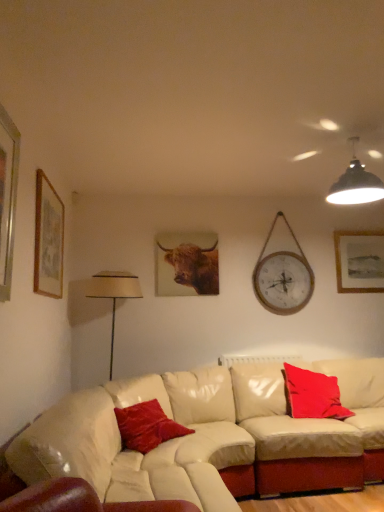
Measure the distance between point [320,386] and camera.

The distance of point [320,386] from camera is 11.64 feet.

The height and width of the screenshot is (512, 384). Describe the element at coordinates (356, 183) in the screenshot. I see `black matte pendant light at upper right` at that location.

What is the approximate height of brown furry cow at center?

It is 24.70 inches.

This screenshot has width=384, height=512. What do you see at coordinates (194, 266) in the screenshot? I see `brown furry cow at center` at bounding box center [194, 266].

I want to click on silver metallic picture frame at left, placed as the second picture frame when sorted from left to right, so click(7, 198).

Where is `red velvet pillow at right, which ranks as the 2th pillow in front-to-back order`? Image resolution: width=384 pixels, height=512 pixels. red velvet pillow at right, which ranks as the 2th pillow in front-to-back order is located at coordinates click(x=313, y=394).

Considering the relative sizes of beige fabric lampshade at left and wooden/textured clock at upper right in the image provided, is beige fabric lampshade at left wider than wooden/textured clock at upper right?

Correct, the width of beige fabric lampshade at left exceeds that of wooden/textured clock at upper right.

Could wooden/textured clock at upper right be considered to be inside beige fabric lampshade at left?

No, wooden/textured clock at upper right is not a part of beige fabric lampshade at left.

How far apart are beige fabric lampshade at left and wooden/textured clock at upper right?

The distance of beige fabric lampshade at left from wooden/textured clock at upper right is 1.44 meters.

From the image's perspective, between beige fabric lampshade at left and wooden/textured clock at upper right, who is located below?

From the image's view, beige fabric lampshade at left is below.

Is black matte pendant light at upper right turned away from wooden framed artwork at upper right, the 3th picture frame positioned from the left?

black matte pendant light at upper right does not have its back to wooden framed artwork at upper right, the 3th picture frame positioned from the left.

Considering the sizes of objects black matte pendant light at upper right and wooden framed artwork at upper right, marked as the third picture frame in a front-to-back arrangement, in the image provided, who is bigger, black matte pendant light at upper right or wooden framed artwork at upper right, marked as the third picture frame in a front-to-back arrangement,?

black matte pendant light at upper right.

Considering the sizes of objects black matte pendant light at upper right and wooden framed artwork at upper right, the 3th picture frame positioned from the left, in the image provided, who is shorter, black matte pendant light at upper right or wooden framed artwork at upper right, the 3th picture frame positioned from the left,?

Standing shorter between the two is black matte pendant light at upper right.

From the image's perspective, between black matte pendant light at upper right and wooden framed artwork at upper left, the 2th picture frame when ordered from front to back, who is located below?

wooden framed artwork at upper left, the 2th picture frame when ordered from front to back, from the image's perspective.

Between black matte pendant light at upper right and wooden framed artwork at upper left, the third picture frame in the right-to-left sequence, which one appears on the right side from the viewer's perspective?

black matte pendant light at upper right.

From a real-world perspective, which is physically below, black matte pendant light at upper right or wooden framed artwork at upper left, the 2th picture frame when ordered from front to back?

From a 3D spatial view, wooden framed artwork at upper left, the 2th picture frame when ordered from front to back, is below.

Does black matte pendant light at upper right have a larger size compared to wooden framed artwork at upper left, the 1th picture frame when ordered from left to right?

Indeed, black matte pendant light at upper right has a larger size compared to wooden framed artwork at upper left, the 1th picture frame when ordered from left to right.

Does point (320, 393) lie in front of point (136, 294)?

Yes, it is.

Between red velvet pillow at right, which ranks as the first pillow in back-to-front order, and beige fabric lampshade at left, which one appears on the right side from the viewer's perspective?

red velvet pillow at right, which ranks as the first pillow in back-to-front order.

Considering the relative sizes of red velvet pillow at right, which is counted as the second pillow, starting from the left, and beige fabric lampshade at left in the image provided, is red velvet pillow at right, which is counted as the second pillow, starting from the left, smaller than beige fabric lampshade at left?

Yes, red velvet pillow at right, which is counted as the second pillow, starting from the left, is smaller than beige fabric lampshade at left.

Is red velvet pillow at right, which ranks as the 2th pillow in front-to-back order, shorter than beige fabric lampshade at left?

Yes, red velvet pillow at right, which ranks as the 2th pillow in front-to-back order, is shorter than beige fabric lampshade at left.

Could you measure the distance between black matte pendant light at upper right and velvet red pillow at center, which is counted as the 2th pillow, starting from the back?

They are 6.73 feet apart.

Between black matte pendant light at upper right and velvet red pillow at center, which is the 2th pillow in right-to-left order, which one has more height?

Standing taller between the two is black matte pendant light at upper right.

Is black matte pendant light at upper right far away from velvet red pillow at center, the first pillow when ordered from front to back?

Yes, black matte pendant light at upper right and velvet red pillow at center, the first pillow when ordered from front to back, are quite far apart.

From the image's perspective, which one is positioned higher, black matte pendant light at upper right or velvet red pillow at center, which is the 2th pillow in right-to-left order?

black matte pendant light at upper right, from the image's perspective.

Which is closer to the camera, (92, 288) or (158, 241)?

Point (92, 288) is positioned closer to the camera compared to point (158, 241).

From a real-world perspective, which is physically below, beige fabric lampshade at left or brown furry cow at center?

beige fabric lampshade at left is physically lower.

Considering the sizes of objects beige fabric lampshade at left and brown furry cow at center in the image provided, who is shorter, beige fabric lampshade at left or brown furry cow at center?

With less height is brown furry cow at center.

Are beige fabric lampshade at left and brown furry cow at center beside each other?

No, beige fabric lampshade at left is not beside brown furry cow at center.

Could you tell me if red velvet pillow at right, which is counted as the second pillow, starting from the left, is turned towards wooden/textured clock at upper right?

No.

Consider the image. From the image's perspective, is red velvet pillow at right, which ranks as the 2th pillow in front-to-back order, located above wooden/textured clock at upper right?

No, from the image's perspective, red velvet pillow at right, which ranks as the 2th pillow in front-to-back order, is not over wooden/textured clock at upper right.

Which point is more distant from viewer, (x=320, y=396) or (x=307, y=295)?

The point (x=307, y=295) is behind.

Is red velvet pillow at right, the first pillow from the right, bigger or smaller than wooden/textured clock at upper right?

Clearly, red velvet pillow at right, the first pillow from the right, is larger in size than wooden/textured clock at upper right.

Where is `clock that appears above the beige fabric lampshade at left (from the image's perspective)`? clock that appears above the beige fabric lampshade at left (from the image's perspective) is located at coordinates (283, 277).

You are a GUI agent. You are given a task and a screenshot of the screen. Output one action in this format:
    pyautogui.click(x=<x>, y=<y>)
    Task: Click on the picture frame on the right of the black matte pendant light at upper right
    This screenshot has height=512, width=384.
    Given the screenshot: What is the action you would take?
    pyautogui.click(x=359, y=261)

Which object lies further to the anchor point wooden framed artwork at upper right, the 3th picture frame positioned from the left, silver metallic picture frame at left, positioned as the 3th picture frame in back-to-front order, or brown furry cow at center?

silver metallic picture frame at left, positioned as the 3th picture frame in back-to-front order, is positioned further to the anchor wooden framed artwork at upper right, the 3th picture frame positioned from the left.

Looking at the image, which one is located further to velvet red pillow at center, the first pillow when ordered from front to back, wooden/textured clock at upper right or red velvet pillow at right, which ranks as the first pillow in back-to-front order?

The object further to velvet red pillow at center, the first pillow when ordered from front to back, is wooden/textured clock at upper right.

Considering their positions, is wooden framed artwork at upper right, the 3th picture frame positioned from the left, positioned further to wooden/textured clock at upper right than black matte pendant light at upper right?

Based on the image, black matte pendant light at upper right appears to be further to wooden/textured clock at upper right.

Estimate the real-world distances between objects in this image. Which object is closer to black matte pendant light at upper right, beige fabric lampshade at left or wooden framed artwork at upper right, acting as the first picture frame starting from the back?

Among the two, wooden framed artwork at upper right, acting as the first picture frame starting from the back, is located nearer to black matte pendant light at upper right.

Based on their spatial positions, is wooden/textured clock at upper right or silver metallic picture frame at left, placed as the second picture frame when sorted from left to right, closer to wooden framed artwork at upper left, the 2th picture frame when ordered from front to back?

silver metallic picture frame at left, placed as the second picture frame when sorted from left to right, is closer to wooden framed artwork at upper left, the 2th picture frame when ordered from front to back.

Based on their spatial positions, is wooden framed artwork at upper right, the 3th picture frame positioned from the left, or beige fabric lampshade at left further from wooden framed artwork at upper left, which is the 2th picture frame from back to front?

wooden framed artwork at upper right, the 3th picture frame positioned from the left, is positioned further to the anchor wooden framed artwork at upper left, which is the 2th picture frame from back to front.

From the image, which object appears to be farther from velvet red pillow at center, which is the 2th pillow in right-to-left order, wooden framed artwork at upper left, which is the 2th picture frame from back to front, or silver metallic picture frame at left, which is the 1th picture frame from front to back?

The object further to velvet red pillow at center, which is the 2th pillow in right-to-left order, is silver metallic picture frame at left, which is the 1th picture frame from front to back.

When comparing their distances from black matte pendant light at upper right, does brown furry cow at center or wooden/textured clock at upper right seem further?

Among the two, brown furry cow at center is located further to black matte pendant light at upper right.

What are the coordinates of `picture frame between wooden framed artwork at upper left, which is the 2th picture frame from back to front, and wooden framed artwork at upper right, acting as the first picture frame starting from the back, in the horizontal direction` in the screenshot? It's located at (7, 198).

Locate an element on the screen. The height and width of the screenshot is (512, 384). lamp between brown furry cow at center and wooden framed artwork at upper right, the 3th picture frame positioned from the left, in the horizontal direction is located at coordinates (356, 183).

Where is `cattle between silver metallic picture frame at left, placed as the second picture frame when sorted from right to left, and wooden/textured clock at upper right from front to back`? The image size is (384, 512). cattle between silver metallic picture frame at left, placed as the second picture frame when sorted from right to left, and wooden/textured clock at upper right from front to back is located at coordinates (194, 266).

Image resolution: width=384 pixels, height=512 pixels. In order to click on lamp located between beige fabric lampshade at left and wooden framed artwork at upper right, the 3th picture frame positioned from the left, in the left-right direction in this screenshot , I will do `click(356, 183)`.